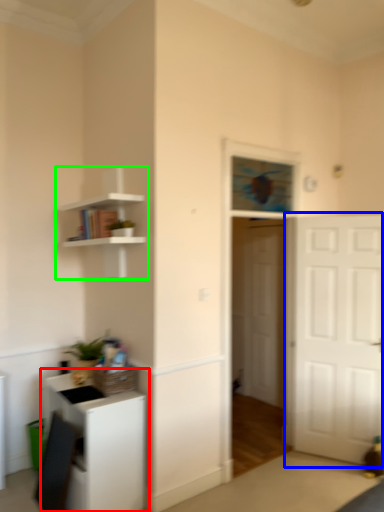
Question: Which object is positioned farthest from cabinetry (highlighted by a red box)? Select from door (highlighted by a blue box) and shelf (highlighted by a green box).

Choices:
 (A) door
 (B) shelf

Answer: (A)